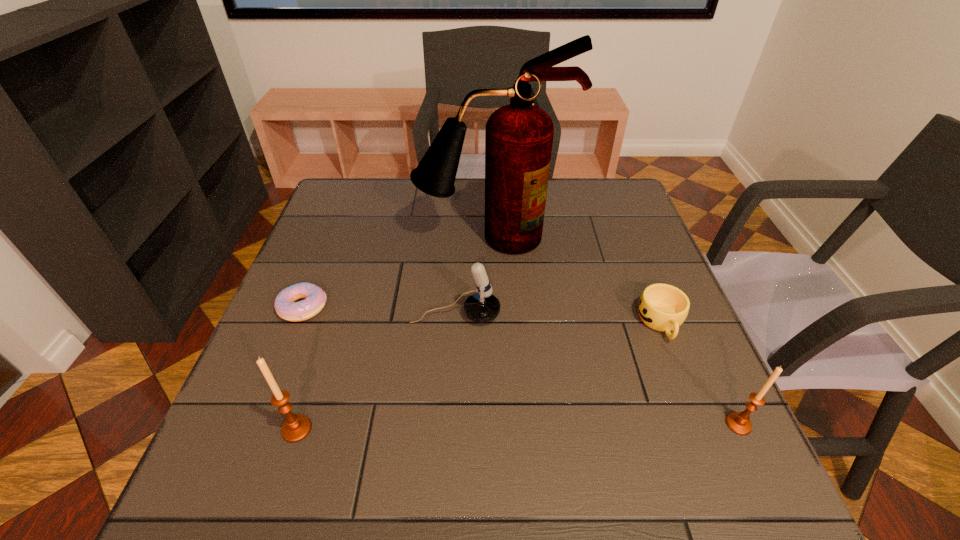
Where is `the taller candle_holder`? Image resolution: width=960 pixels, height=540 pixels. the taller candle_holder is located at coordinates (296, 427).

Locate an element on the screen. The width and height of the screenshot is (960, 540). the left candle_holder is located at coordinates (296, 427).

Locate an element on the screen. the shorter candle_holder is located at coordinates (739, 423).

This screenshot has height=540, width=960. I want to click on the tallest object, so click(518, 137).

At what (x,y) coordinates should I click in order to perform the action: click on fire extinguisher. Please return your answer as a coordinate pair (x, y). This screenshot has width=960, height=540. Looking at the image, I should click on [x=518, y=137].

Find the location of `doughnut`. doughnut is located at coordinates (286, 307).

The height and width of the screenshot is (540, 960). In order to click on microphone in this screenshot , I will do `click(483, 306)`.

Identify the location of the fifth tallest object. The height and width of the screenshot is (540, 960). tap(662, 307).

This screenshot has height=540, width=960. Identify the location of vacant space located 0.170m on the right of the taller candle_holder. (405, 429).

This screenshot has width=960, height=540. I want to click on vacant space situated on the left of the shorter candle_holder, so click(683, 424).